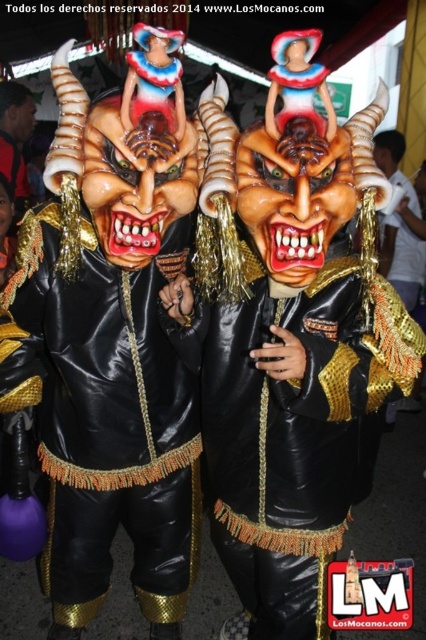
Between black leather mask at center and shiny black leather mask at center, which one has less height?

With less height is shiny black leather mask at center.

Does black leather mask at center have a greater width compared to shiny black leather mask at center?

In fact, black leather mask at center might be narrower than shiny black leather mask at center.

Is point (72, 529) positioned before point (287, 525)?

No, it is not.

Find the location of `black leather mask at center`. black leather mask at center is located at coordinates (104, 417).